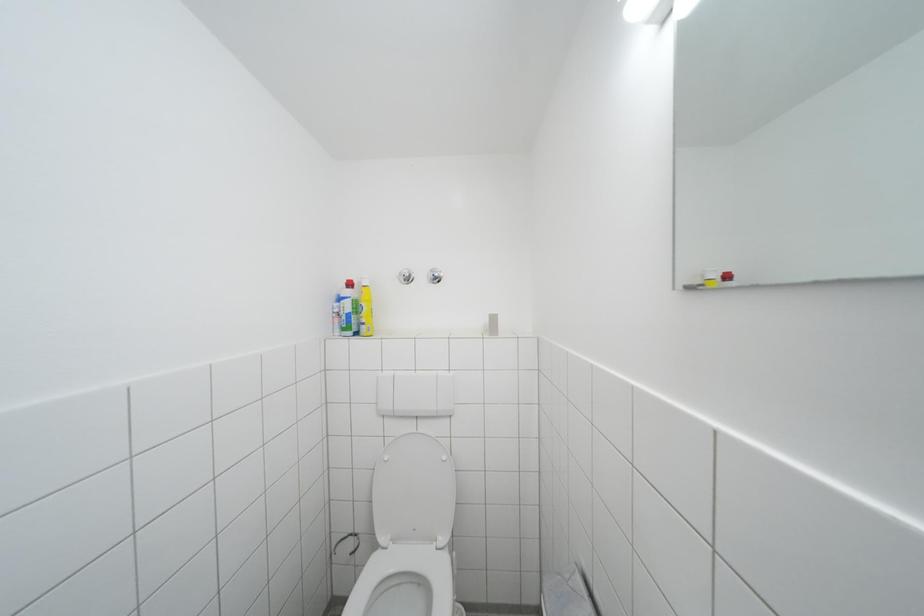
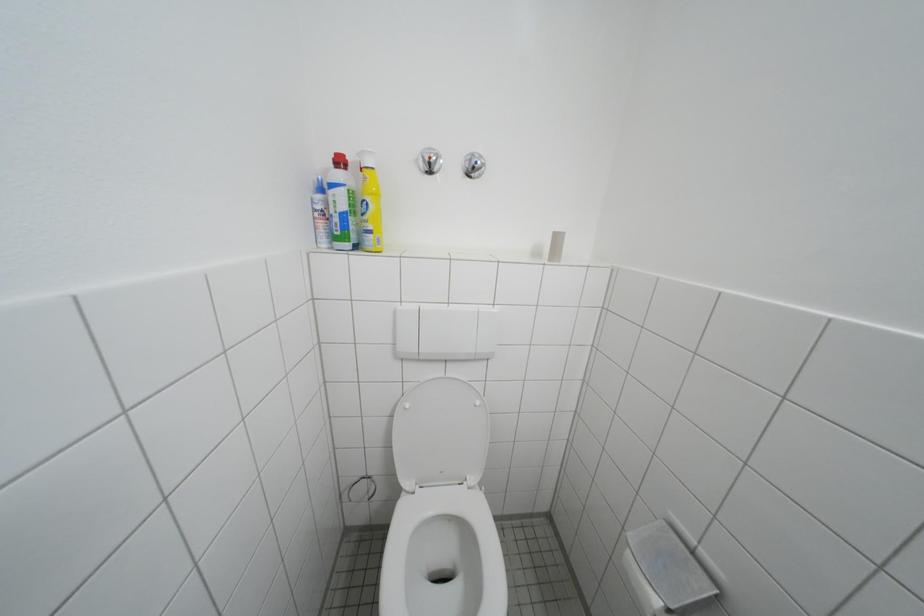
Question: How did the camera likely rotate?

Choices:
 (A) Left
 (B) Right
 (C) Up
 (D) Down

Answer: (D)